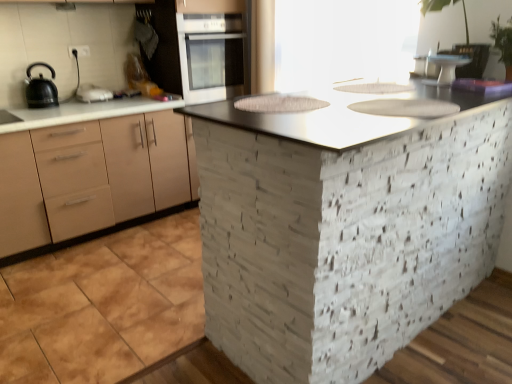
Find the location of a particular element. The height and width of the screenshot is (384, 512). vacant space in front of white glossy cake stand at upper right is located at coordinates (471, 84).